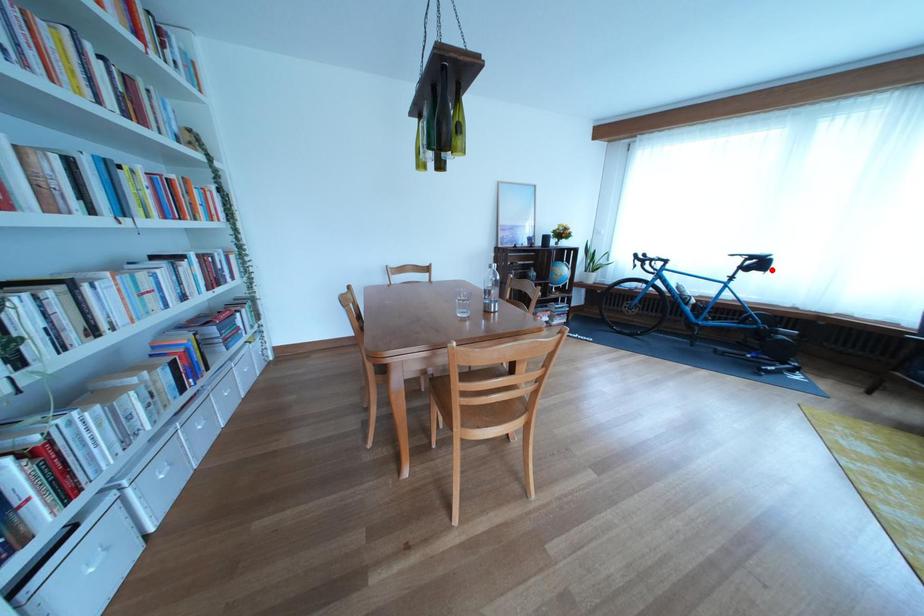
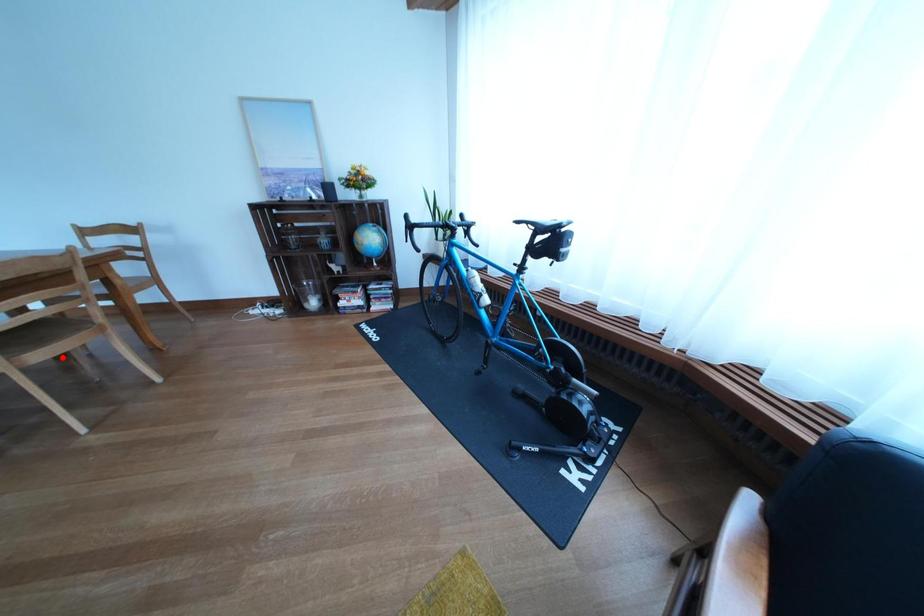
I am providing you with two images of the same scene from different viewpoints. A red point is marked on the first image and another point is marked on the second image. Are the points marked in image1 and image2 representing the same 3D position?

No